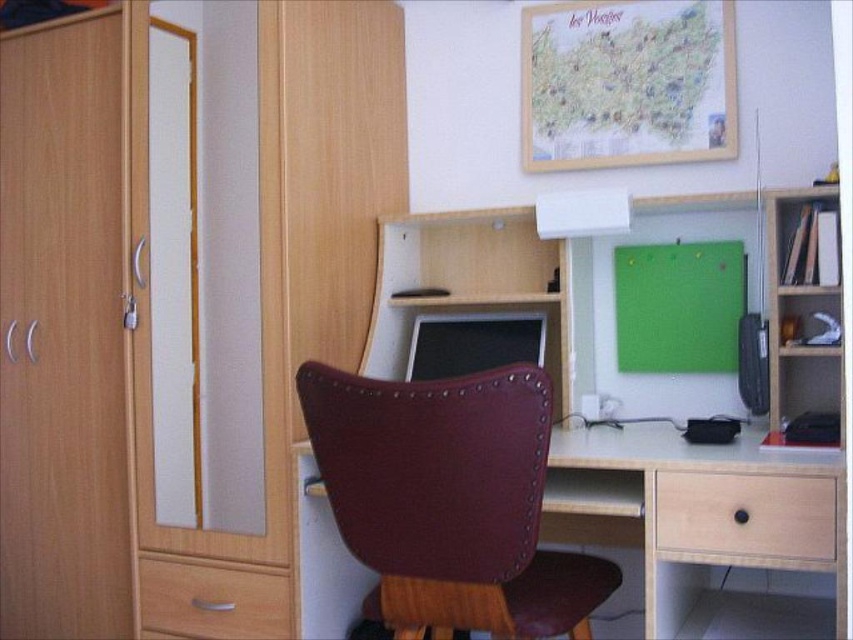
Does leather-like burgundy swivel chair at center have a lesser height compared to matte black monitor at center?

Incorrect, leather-like burgundy swivel chair at center's height does not fall short of matte black monitor at center's.

Does leather-like burgundy swivel chair at center appear on the left side of matte black monitor at center?

Indeed, leather-like burgundy swivel chair at center is positioned on the left side of matte black monitor at center.

What do you see at coordinates (450, 500) in the screenshot? This screenshot has height=640, width=853. I see `leather-like burgundy swivel chair at center` at bounding box center [450, 500].

This screenshot has width=853, height=640. Find the location of `leather-like burgundy swivel chair at center`. leather-like burgundy swivel chair at center is located at coordinates click(450, 500).

Who is shorter, light brown wood drawer at lower right or matte black monitor at center?

light brown wood drawer at lower right is shorter.

Which is behind, point (676, 492) or point (537, 326)?

Positioned behind is point (537, 326).

Who is more forward, (763, 554) or (491, 365)?

Point (763, 554) is more forward.

Where is `light brown wood drawer at lower right`? The height and width of the screenshot is (640, 853). light brown wood drawer at lower right is located at coordinates (746, 515).

Between leather-like burgundy swivel chair at center and light brown wood drawer at lower right, which one is positioned higher?

light brown wood drawer at lower right is higher up.

Does leather-like burgundy swivel chair at center appear on the left side of light brown wood drawer at lower right?

Indeed, leather-like burgundy swivel chair at center is positioned on the left side of light brown wood drawer at lower right.

Locate an element on the screen. Image resolution: width=853 pixels, height=640 pixels. leather-like burgundy swivel chair at center is located at coordinates (450, 500).

Locate an element on the screen. The height and width of the screenshot is (640, 853). leather-like burgundy swivel chair at center is located at coordinates (450, 500).